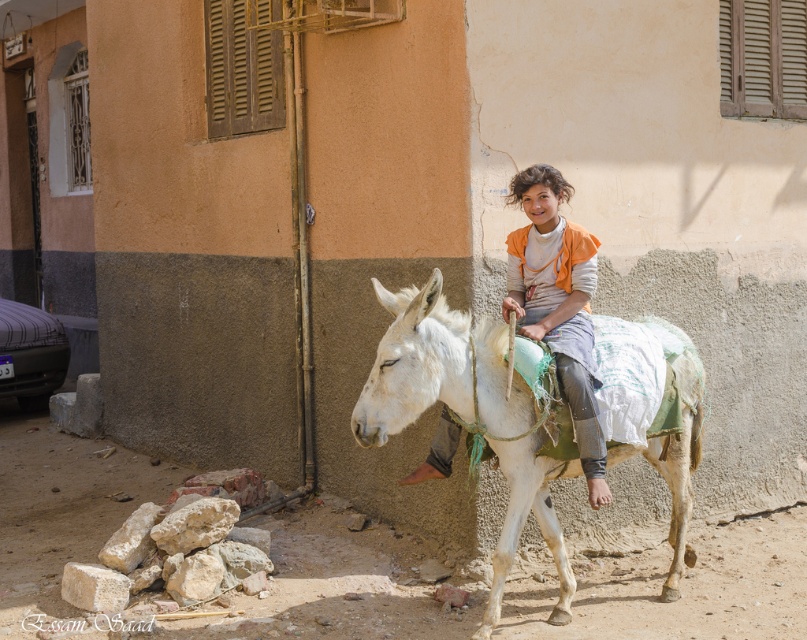
You are a photographer trying to capture a photo of the orange fabric shirt at center and the metallic car at left. Based on their sizes in the image, which object should you focus on first if you want to ensure both are in frame without moving the camera?

The orange fabric shirt at center is taller than the metallic car at left, so you should focus on the orange fabric shirt at center first to ensure both fit in the frame.

You are a photographer trying to capture the white matte mule at center and the orange fabric shirt at center in a single frame. Based on their positions, which object should you focus on first to ensure both are in the shot?

The white matte mule at center is in front of the orange fabric shirt at center, so you should focus on the white matte mule at center first to ensure both are in the shot.

You are standing at the point with coordinates point (398, 324) and want to walk towards the point (552, 326). Which direction should you face to walk directly towards your destination?

Since point (398, 324) is in front of point (552, 326), you should face backward to walk directly towards point (552, 326).